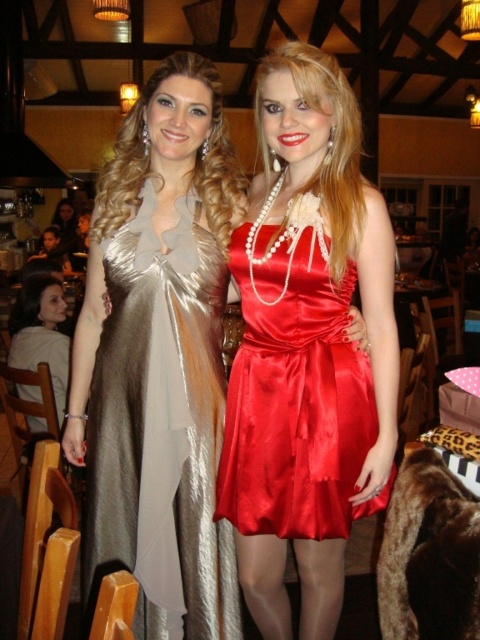
You are a photographer adjusting your camera settings. You notice two points in the image at coordinates point (192, 595) and point (228, 396). Which point should you focus on to ensure the subject closest to the camera is in sharp focus?

Point (192, 595) is closer to the camera than point (228, 396), so you should focus on point (192, 595) to ensure the subject closest to the camera is in sharp focus.

You are a photographer at a social event. You need to capture a photo of both the satin metallic dress at center and the shiny red dress at center. Which dress should you focus on first if you want to capture them from left to right in the order they appear?

The satin metallic dress at center is to the left of shiny red dress at center, so you should focus on the satin metallic dress at center first followed by the shiny red dress at center to capture them from left to right.